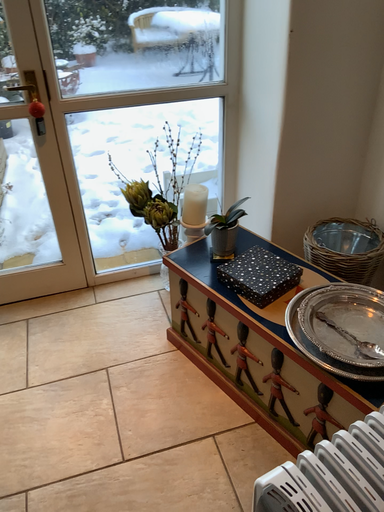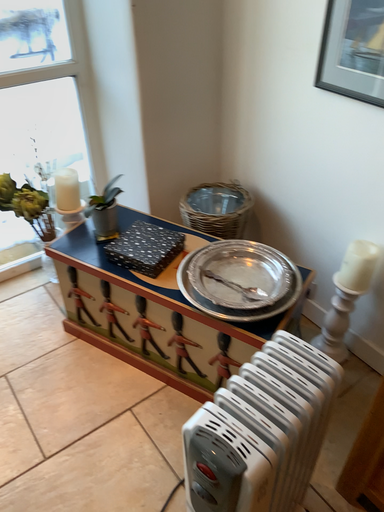
Question: How did the camera likely rotate when shooting the video?

Choices:
 (A) rotated left
 (B) rotated right

Answer: (B)